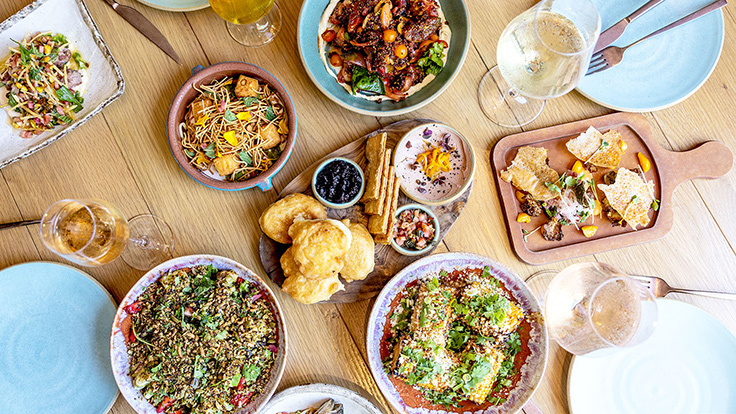
Locate an element on the screen. This screenshot has width=736, height=414. table is located at coordinates (467, 106).